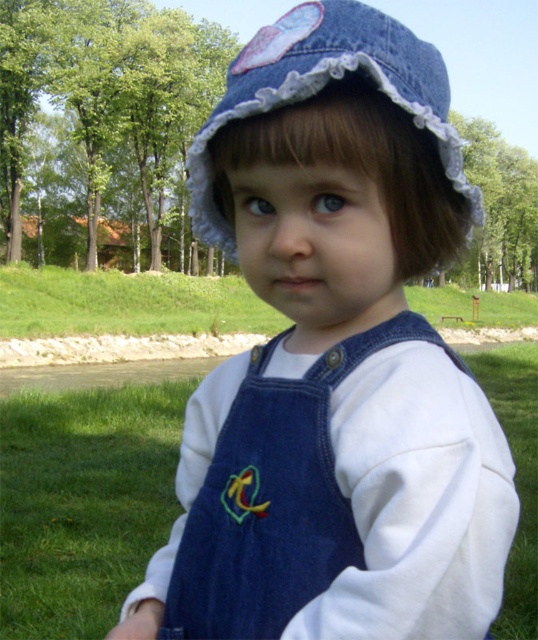
You are standing at point (122,419) and want to reach the park entrance located at the opposite corner of the park. If your walking speed is 1.2 meters per second, how many seconds will it take you to reach the entrance?

The distance between the points is 8.37 meters. At a speed of 1.2 meters per second, it will take approximately 6.98 seconds to reach the entrance.

Based on the scene described, which object occupies more horizontal space in the image? The green grass at lower left or the denim hat at center?

The green grass at lower left might be wider than the denim hat at center, so it likely occupies more horizontal space.